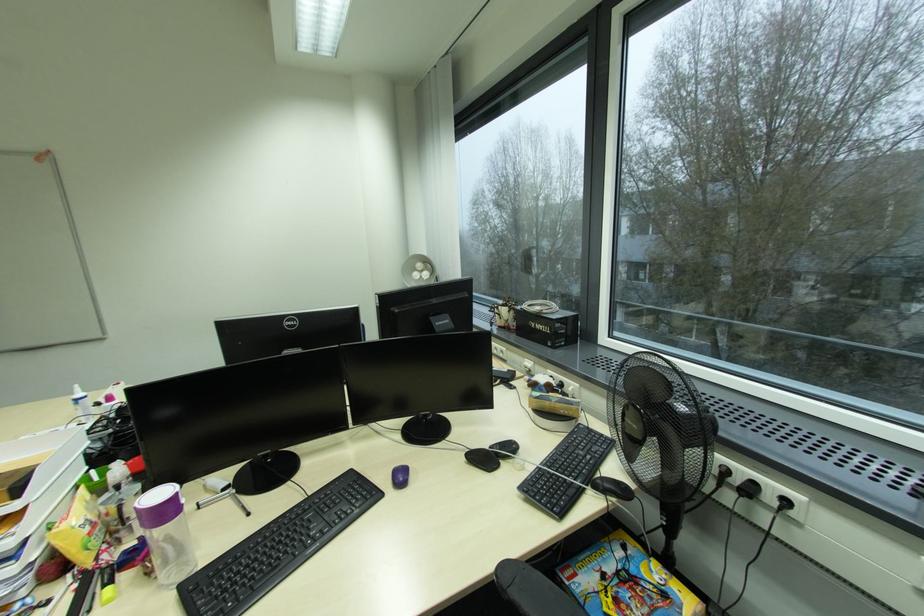
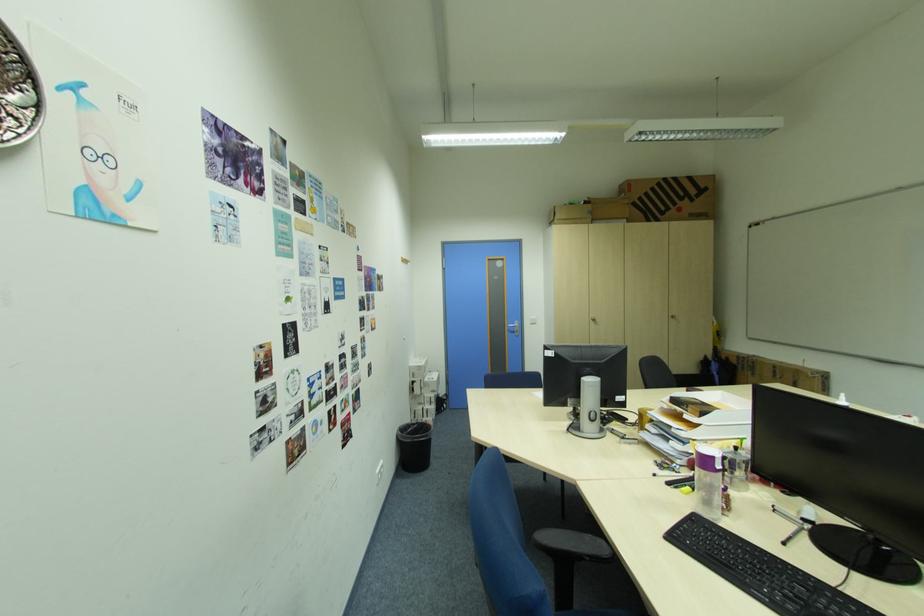
Question: The camera is either moving clockwise (left) or counter-clockwise (right) around the object. The first image is from the beginning of the video and the second image is from the end. Is the camera moving left or right when shooting the video?

Choices:
 (A) Left
 (B) Right

Answer: (B)